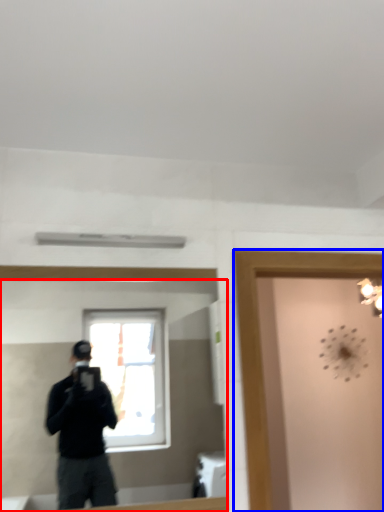
Question: Which object is further to the camera taking this photo, mirror (highlighted by a red box) or glass door (highlighted by a blue box)?

Choices:
 (A) mirror
 (B) glass door

Answer: (B)